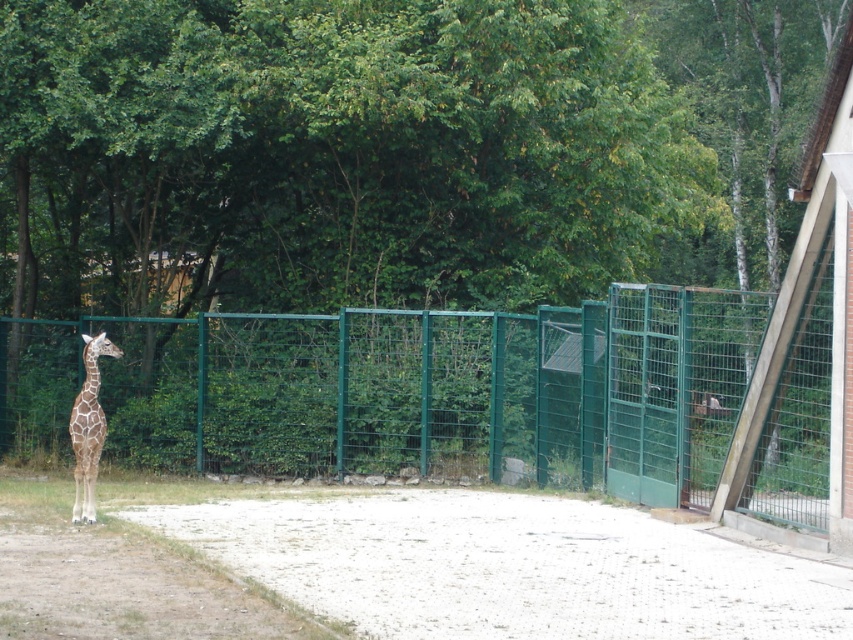
You are a zookeeper trying to determine if the spotted fur giraffe at left can reach the white gravel at center for its diet. Based on their positions, can the giraffe easily access the gravel?

The white gravel at center is wider than the spotted fur giraffe at left, so the giraffe can easily access the gravel since it is positioned in the center and the giraffe is on the left side of the frame.

You are a zookeeper trying to clean the enclosure. You have a 1 meter wide cleaning cart. Can you move the cart through the open gate on the right side of the fence, considering the size of the white gravel at center and the spotted fur giraffe at left?

The white gravel at center is bigger than the spotted fur giraffe at left. However, the question is about the size of the gate, not the gravel or giraffe. Since the problem does not provide information about the gate size, I cannot determine if the cart can pass through. Please check the gate dimensions.